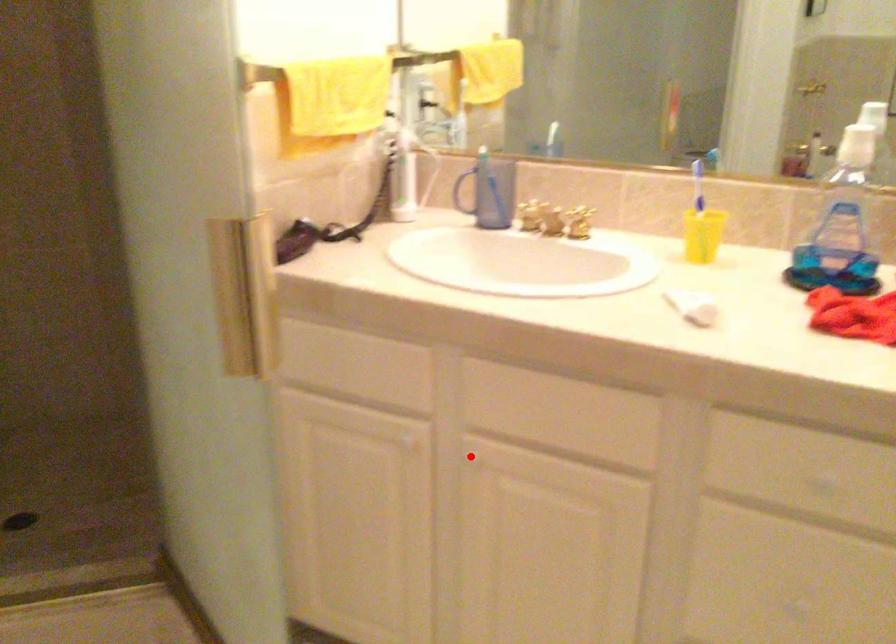
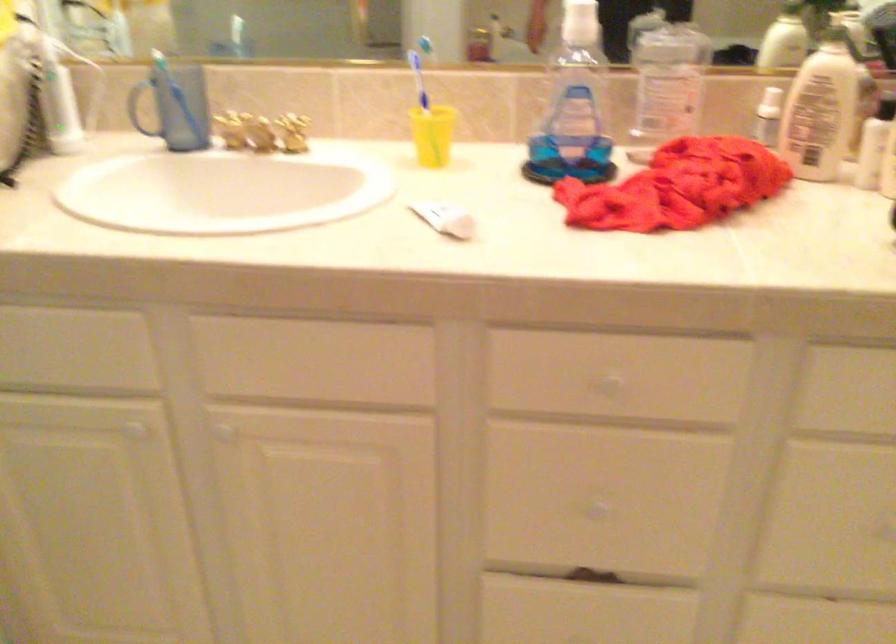
In the second image, find the point that corresponds to the highlighted location in the first image.

(222, 428)